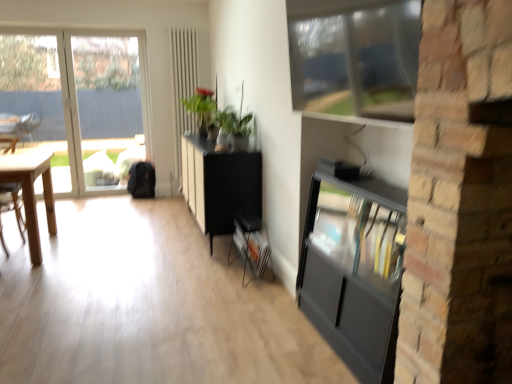
Where is `vacant area that is situated to the right of light wood desk at left`? Image resolution: width=512 pixels, height=384 pixels. vacant area that is situated to the right of light wood desk at left is located at coordinates (95, 247).